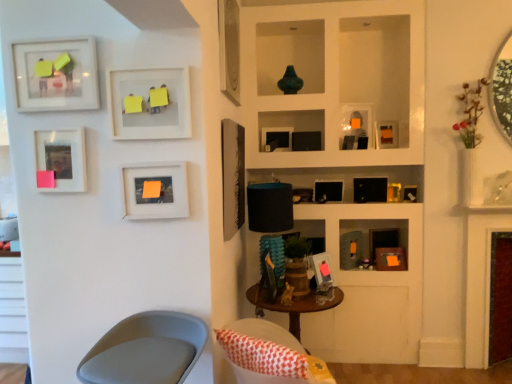
Question: Is matte black picture frame at center, positioned as the seventh picture frame in right-to-left order, to the left or to the right of maroon velvet fireplace at right in the image?

Choices:
 (A) left
 (B) right

Answer: (A)

Question: In terms of width, does matte black picture frame at center, positioned as the 7th picture frame in left-to-right order, look wider or thinner when compared to maroon velvet fireplace at right?

Choices:
 (A) wide
 (B) thin

Answer: (A)

Question: Considering the real-world distances, which object is closest to the matte wood picture frame at center, the fourth picture frame when ordered from left to right?

Choices:
 (A) matte black picture frame at upper center, which is counted as the fifth picture frame, starting from the right
 (B) wooden table at center
 (C) matte black picture frame at upper right, which is the thirteenth picture frame from left to right
 (D) maroon velvet fireplace at right
 (E) black matte picture frame at center, the 8th picture frame when ordered from left to right

Answer: (B)

Question: Which is nearer to the matte black picture frame at upper right, which ranks as the second picture frame in right-to-left order?

Choices:
 (A) metallic silver mirror at upper right
 (B) black matte picture frame at upper right, placed as the fourth picture frame when sorted from right to left
 (C) wooden table at center
 (D) maroon velvet fireplace at right
 (E) matte white picture frame at upper left, acting as the first picture frame starting from the left

Answer: (B)